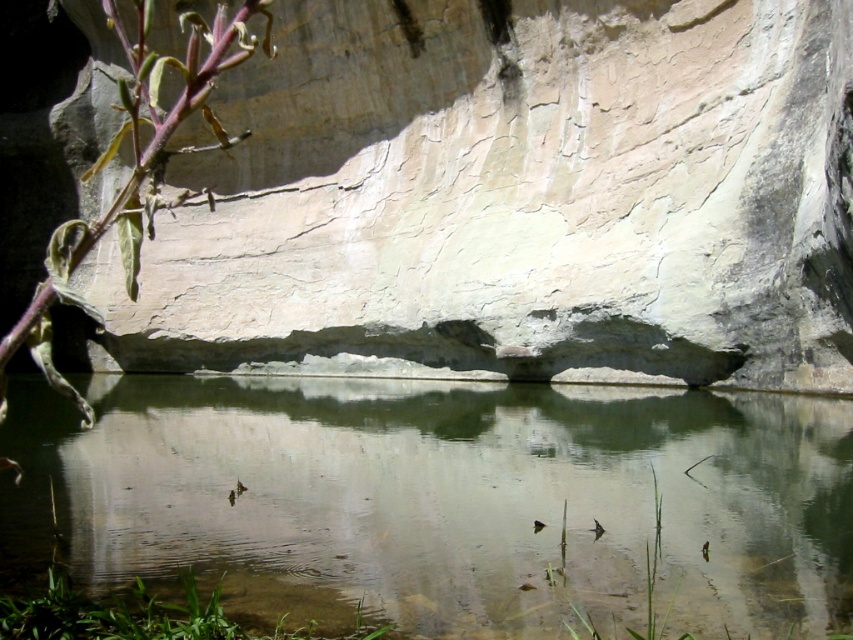
Question: Is clear water at center bigger than green leafy plant at lower left?

Choices:
 (A) no
 (B) yes

Answer: (B)

Question: Is clear water at center further to the viewer compared to green leafy plant at lower left?

Choices:
 (A) no
 (B) yes

Answer: (B)

Question: Can you confirm if clear water at center is positioned to the left of green leafy plant at lower left?

Choices:
 (A) yes
 (B) no

Answer: (B)

Question: Which of the following is the closest to the observer?

Choices:
 (A) (50, 468)
 (B) (55, 627)

Answer: (B)